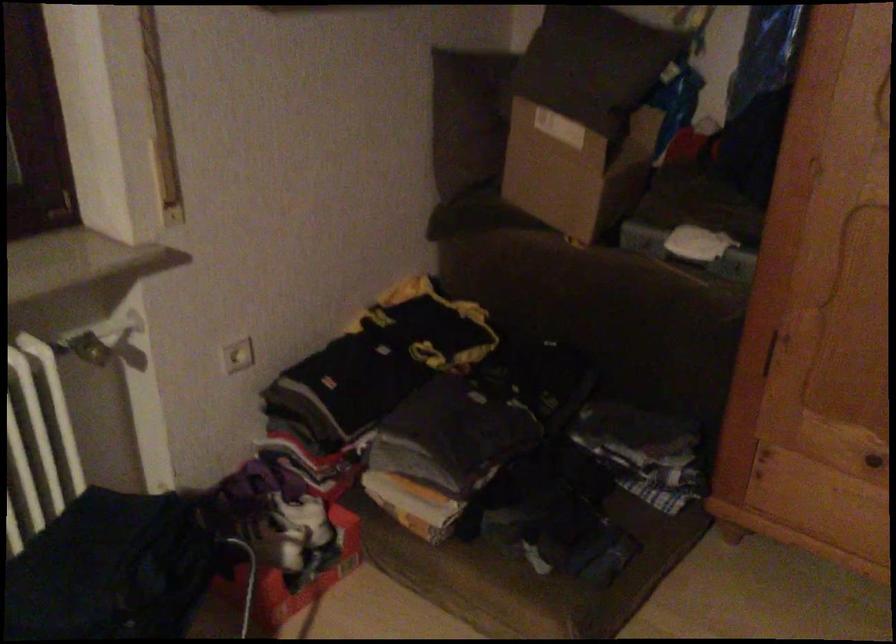
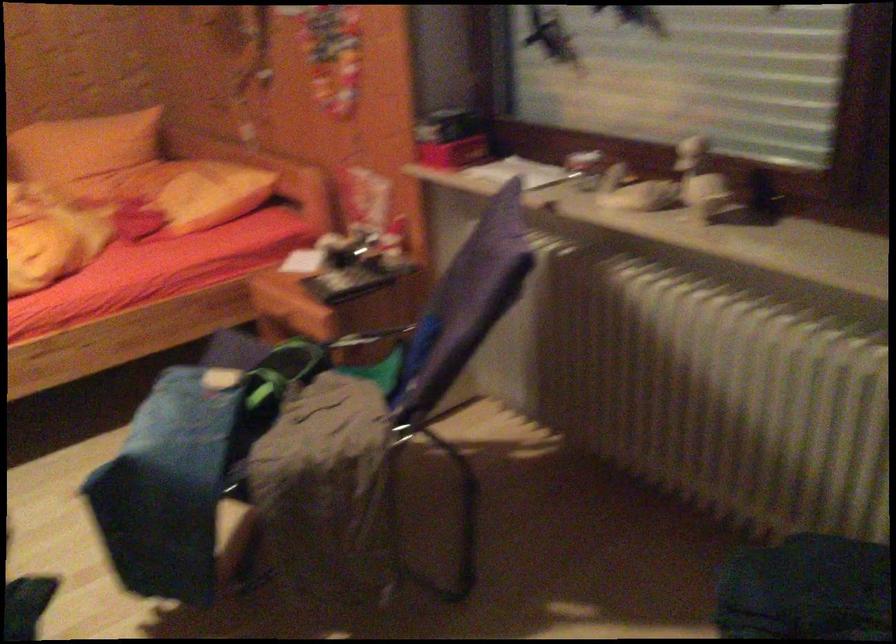
First-person continuous shooting, in which direction is the camera rotating?

The camera's rotation is toward left-down.